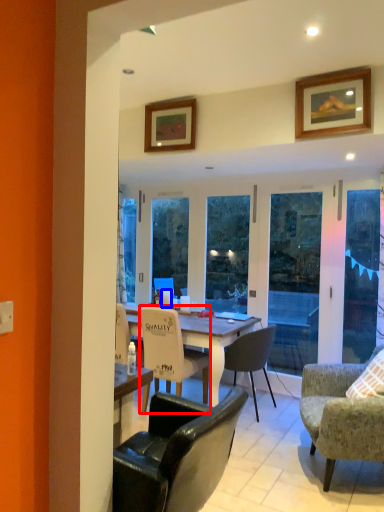
Question: Which object is further to the camera taking this photo, chair (highlighted by a red box) or coffee cup (highlighted by a blue box)?

Choices:
 (A) chair
 (B) coffee cup

Answer: (B)